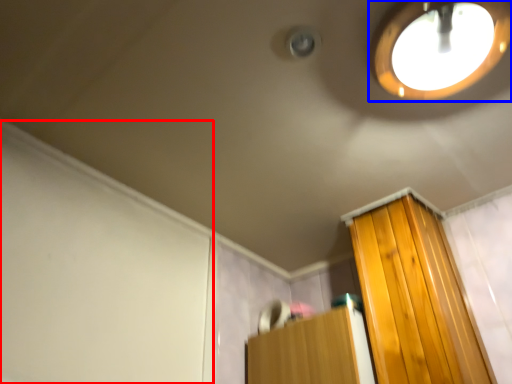
Question: Which object appears farthest to the camera in this image, screen door (highlighted by a red box) or droplight (highlighted by a blue box)?

Choices:
 (A) screen door
 (B) droplight

Answer: (A)